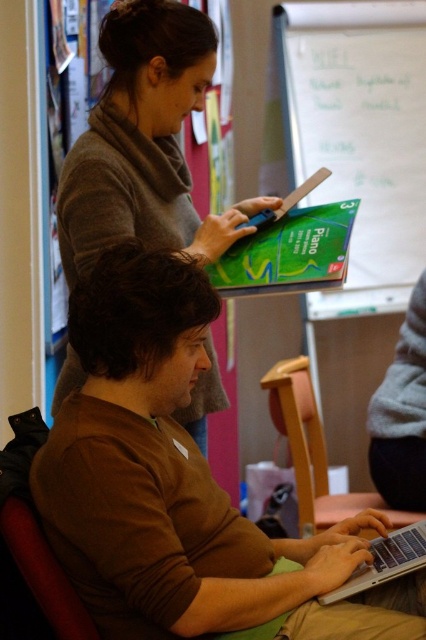
You are organizing a classroom and need to place a new whiteboard. The current whiteboard is at upper center. Where should you place the new whiteboard to avoid overlapping with the green cardboard box at upper center?

The green cardboard box at upper center is located at point (359,136), so you should place the new whiteboard away from that coordinate to prevent overlapping.

You are a student who needs to reach the whiteboard in the background. The whiteboard is mounted on the wall behind the silver metallic laptop at lower center. Can the brown matte shirt at center help you reach the whiteboard?

The brown matte shirt at center is much taller than the silver metallic laptop at lower center, so the brown matte shirt at center can easily reach the whiteboard mounted behind the laptop.

You are standing in the classroom and want to hand the book to the person in the matte gray sweater at upper left without disturbing the person sitting on the wooden chair at lower center. Can you reach them directly from your current position?

The matte gray sweater at upper left is closer to the viewer than the wooden chair at lower center, so yes, you can reach them directly without disturbing the person on the wooden chair at lower center.